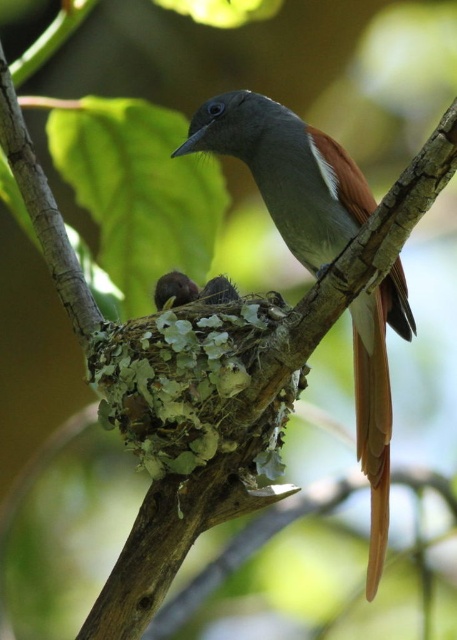
Question: Can you confirm if brown glossy bird at center is positioned above brown feathered nest at center?

Choices:
 (A) no
 (B) yes

Answer: (B)

Question: Which object is farther from the camera taking this photo?

Choices:
 (A) brown glossy bird at center
 (B) brown feathered nest at center

Answer: (B)

Question: Can you confirm if brown glossy bird at center is positioned to the left of brown feathered nest at center?

Choices:
 (A) no
 (B) yes

Answer: (A)

Question: Can you confirm if brown glossy bird at center is bigger than brown feathered nest at center?

Choices:
 (A) yes
 (B) no

Answer: (A)